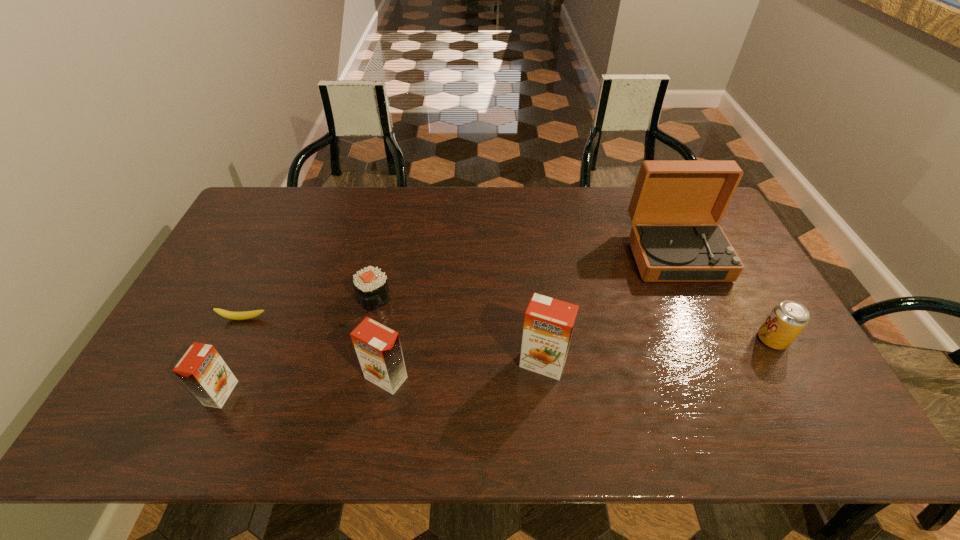
Where is `the shortest orange juice`? the shortest orange juice is located at coordinates (202, 370).

Identify the location of the leftmost orange juice. (202, 370).

Where is `the second orange juice from right to left`? The height and width of the screenshot is (540, 960). the second orange juice from right to left is located at coordinates (378, 348).

Identify the location of the fifth shortest object. (378, 348).

Where is `the rightmost orange juice`? This screenshot has width=960, height=540. the rightmost orange juice is located at coordinates (548, 325).

Identify the location of the farthest object. This screenshot has height=540, width=960. (666, 192).

Find the location of a particular element. The width and height of the screenshot is (960, 540). phonograph record is located at coordinates click(x=666, y=192).

I want to click on the fifth tallest object, so click(788, 318).

This screenshot has height=540, width=960. I want to click on the sixth tallest object, so click(371, 288).

This screenshot has height=540, width=960. I want to click on the second farthest object, so click(371, 288).